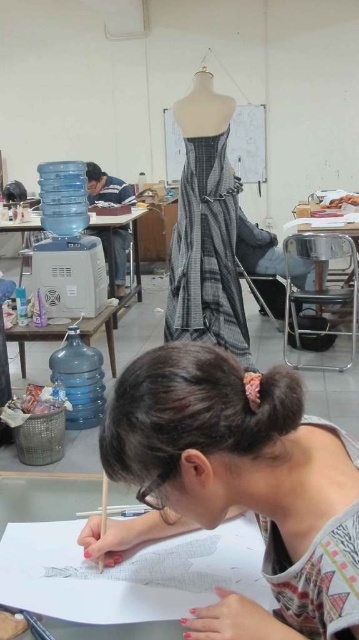
You are standing in the workspace and want to pick up the striped fabric dress at center and the matte plastic table at lower left. Which object is easier to reach without moving your current position?

The striped fabric dress at center is closer to the viewer than the matte plastic table at lower left, so it is easier to reach without moving.

You are organizing a fashion show and need to decide which item to place on a display stand. The striped fabric dress at center and the matte plastic table at lower left are both candidates. Based on their sizes, which item would be more suitable for the display stand?

The striped fabric dress at center has a larger size compared to the matte plastic table at lower left, so it would be more suitable for the display stand as it can be prominently showcased.